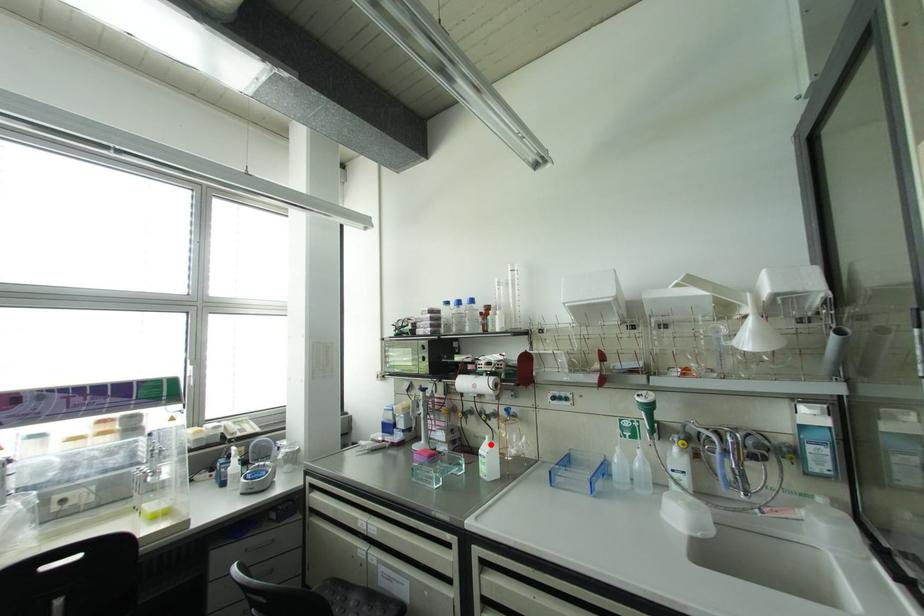
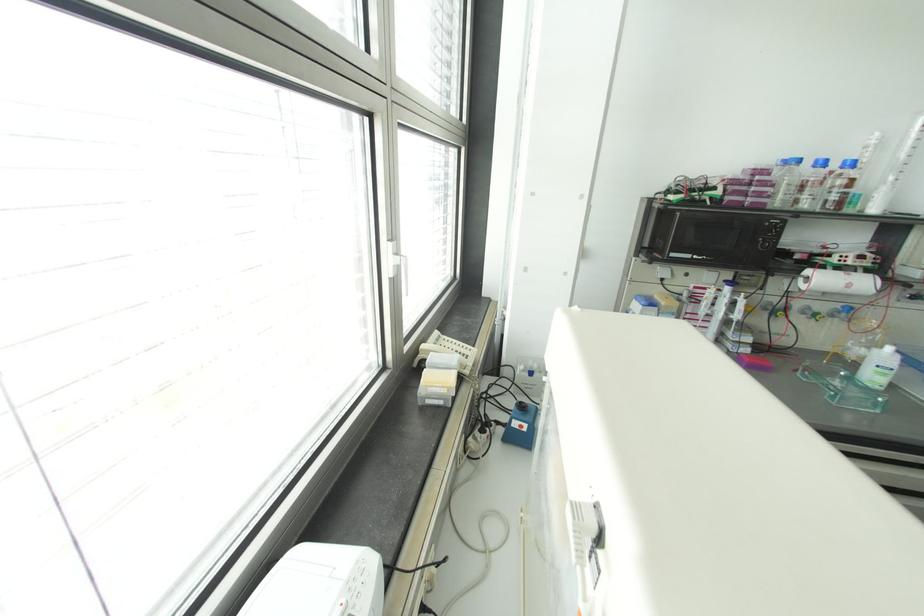
The point at the highlighted location is marked in the first image. Where is the corresponding point in the second image?

(898, 355)